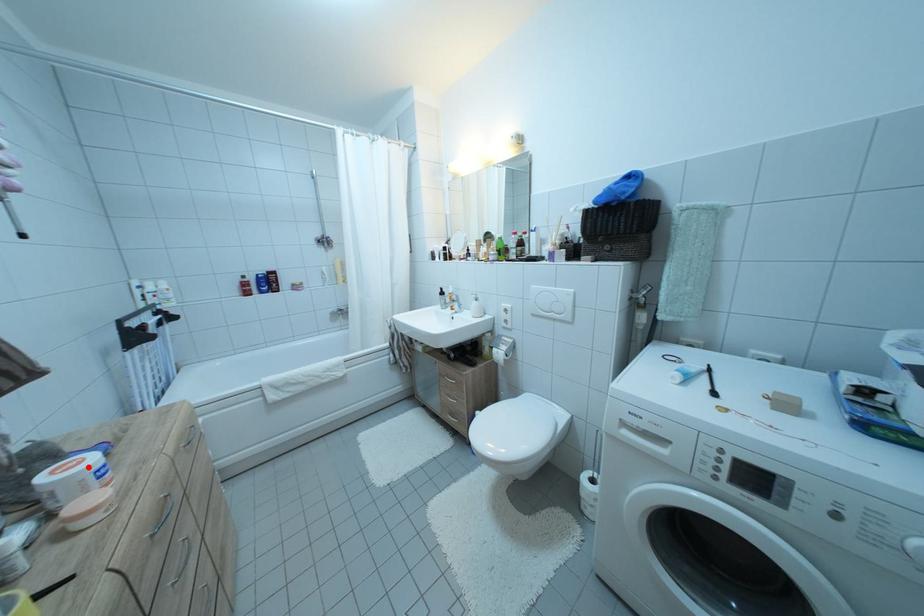
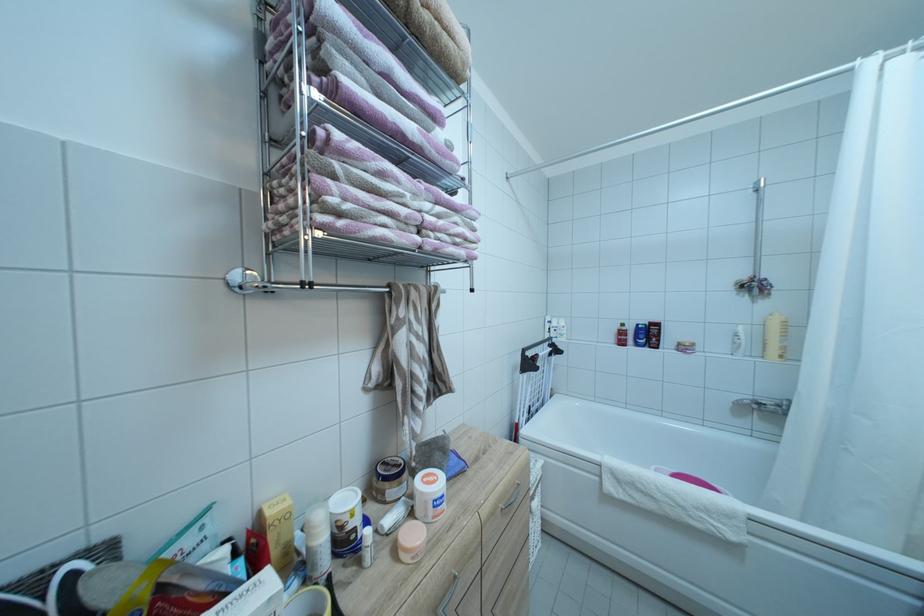
Question: I am providing you with two images of the same scene from different viewpoints. A red point is marked on the first image. Can you still see the location of the red point in image 2?

Choices:
 (A) Yes
 (B) No

Answer: (A)